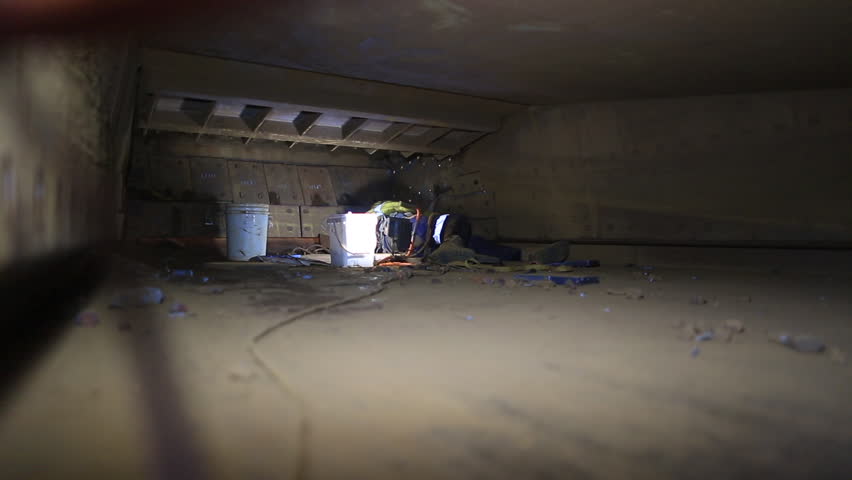
Locate an element on the screen. The width and height of the screenshot is (852, 480). cardboard box is located at coordinates (285, 210), (314, 220), (199, 217).